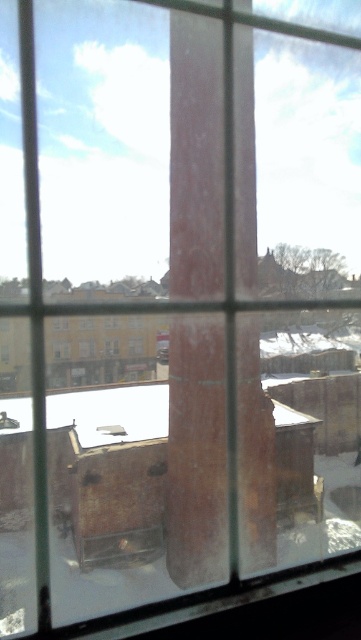
You are an architect designing a new building and want to ensure that the yellowish glass window at center can be seen clearly from the brown wood pillar at center. Based on the scene description, is there any obstruction between them?

The brown wood pillar at center is positioned on the right side of yellowish glass window at center, so the pillar does not obstruct the view between them. The yellowish glass window at center can be seen clearly from the brown wood pillar at center.

You are an interior designer planning to install a decorative item on the wall. You have a choice between placing it on the brown wood pillar at center or the yellowish glass window at center. Considering their widths, which surface would allow for a wider decorative item?

The brown wood pillar at center has a larger width than the yellowish glass window at center, so it can accommodate a wider decorative item.